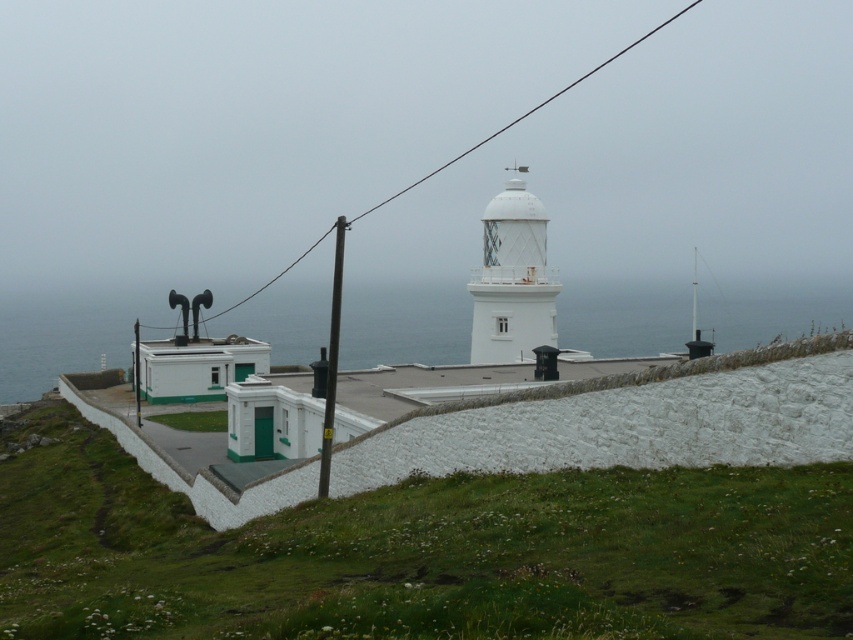
Looking at this image, between white textured lighthouse at center and smooth metal pole at center, which one has more height?

white textured lighthouse at center

Is point (514, 262) positioned before point (134, 323)?

Yes, point (514, 262) is in front of point (134, 323).

Between point (553, 324) and point (138, 422), which one is positioned behind?

Point (553, 324)

Locate an element on the screen. The height and width of the screenshot is (640, 853). white textured lighthouse at center is located at coordinates (512, 280).

Between black wire at upper center and smooth metal pole at center, which one appears on the right side from the viewer's perspective?

From the viewer's perspective, black wire at upper center appears more on the right side.

Is point (366, 209) farther from viewer compared to point (135, 352)?

That is True.

Who is more distant from viewer, (459,156) or (137,368)?

The point (459,156) is more distant.

The image size is (853, 640). In order to click on black wire at upper center in this screenshot , I will do `click(523, 115)`.

Who is higher up, transparent water at lower left or smooth metal pole at center?

transparent water at lower left is higher up.

Does transparent water at lower left have a greater height compared to smooth metal pole at center?

Correct, transparent water at lower left is much taller as smooth metal pole at center.

You are a GUI agent. You are given a task and a screenshot of the screen. Output one action in this format:
    pyautogui.click(x=<x>, y=<y>)
    Task: Click on the transparent water at lower left
    The height and width of the screenshot is (640, 853).
    Given the screenshot: What is the action you would take?
    pyautogui.click(x=67, y=333)